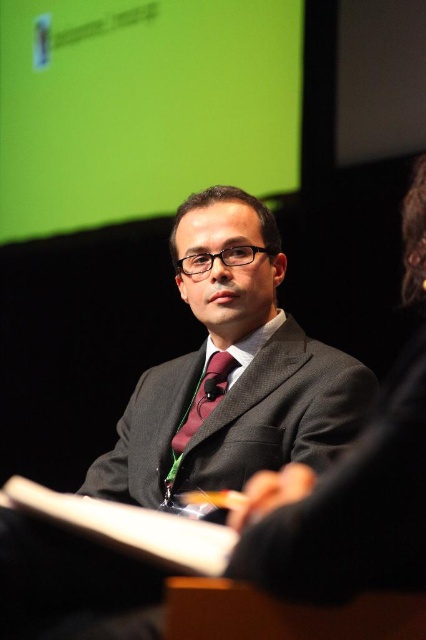
Based on the coordinates provided, which object is located at point [232,371] in the image?

The point [232,371] indicates the dark gray suit at center.

You are a fashion designer analyzing the image of a man in formal attire. You need to compare the widths of the dark gray suit at center and the maroon satin tie at center. Which one is wider?

The dark gray suit at center is wider than the maroon satin tie at center according to the description.